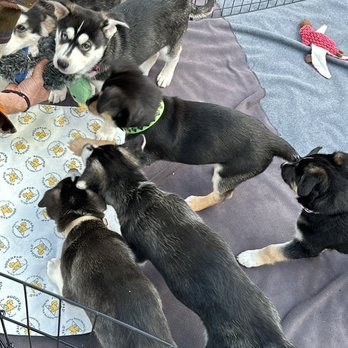
Image resolution: width=348 pixels, height=348 pixels. Find the location of `pink toy`. pink toy is located at coordinates (324, 44).